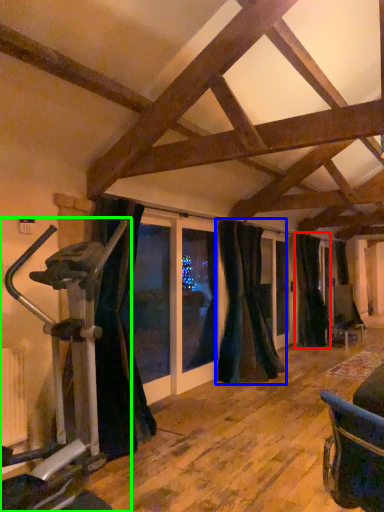
Question: Considering the real-world distances, which object is closest to curtain (highlighted by a red box)? curtain (highlighted by a blue box) or stationary bicycle (highlighted by a green box).

Choices:
 (A) curtain
 (B) stationary bicycle

Answer: (A)